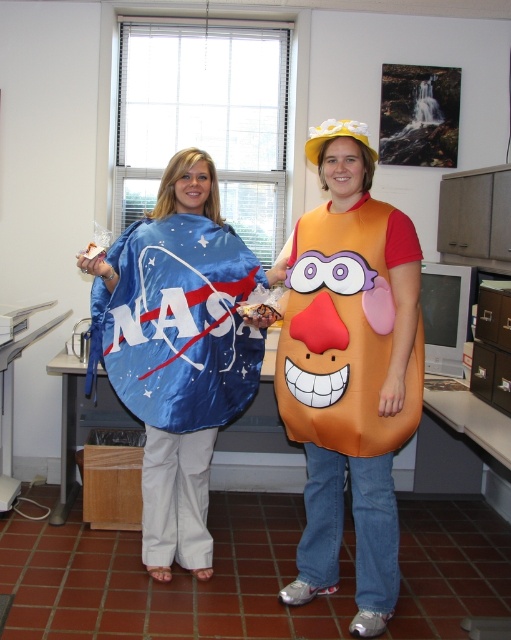
You are an astronaut in training and need to reach both the blue fabric nasa cape at left and the orange fabric potato at center. Which object should you grab first based on their positions?

The blue fabric nasa cape at left is located above the orange fabric potato at center, so you should grab the orange fabric potato at center first since it is lower and easier to reach.

You are standing in the office and want to place a new poster on the wall. There are two points marked on the wall where you can hang it. The points are labeled as point 1 at coordinates point (410, 243) and point 2 at coordinates point (158, 433). Which point is closer to you when you are facing the wall?

Point 1 at coordinates point (410, 243) is closer to the viewer than point 2 at coordinates point (158, 433), so you should choose point 1 if you want the poster to be closer.

You are an astronaut in training and need to locate your NASA costume for a presentation. You see the blue fabric nasa cape at left in the image. Where exactly is the cape positioned relative to the potato character from Toy Story?

The blue fabric NASA cape at left is located at coordinates point (177, 349), which places it to the left of the potato character from Toy Story in the image.